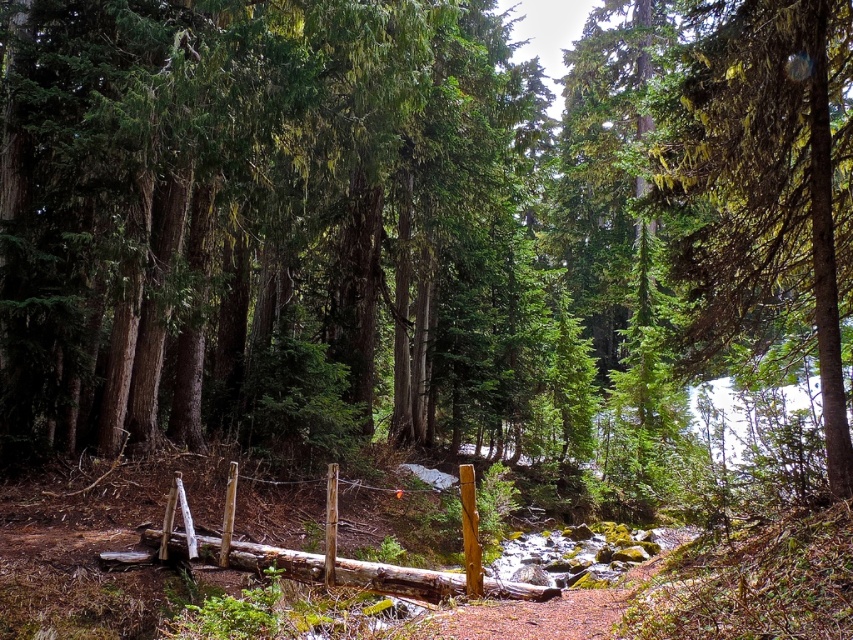
Question: Is green mossy tree at upper right below natural wood log at center?

Choices:
 (A) yes
 (B) no

Answer: (B)

Question: Among these objects, which one is farthest from the camera?

Choices:
 (A) natural wood log at center
 (B) green mossy tree at upper right

Answer: (A)

Question: Is green mossy tree at upper right thinner than natural wood log at center?

Choices:
 (A) yes
 (B) no

Answer: (A)

Question: Does green mossy tree at upper right have a lesser width compared to natural wood log at center?

Choices:
 (A) no
 (B) yes

Answer: (B)

Question: Which of the following is the farthest from the observer?

Choices:
 (A) green mossy tree at upper right
 (B) natural wood log at center

Answer: (B)